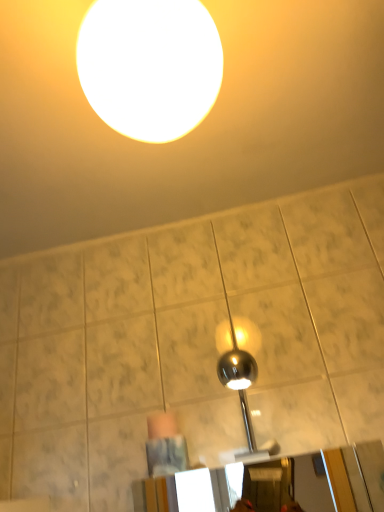
At what (x,y) coordinates should I click in order to perform the action: click on white glossy sphere at upper center. Please return your answer as a coordinate pair (x, y). Looking at the image, I should click on (150, 66).

Describe the element at coordinates (150, 66) in the screenshot. I see `white glossy sphere at upper center` at that location.

In order to click on white glossy sphere at upper center in this screenshot , I will do `click(150, 66)`.